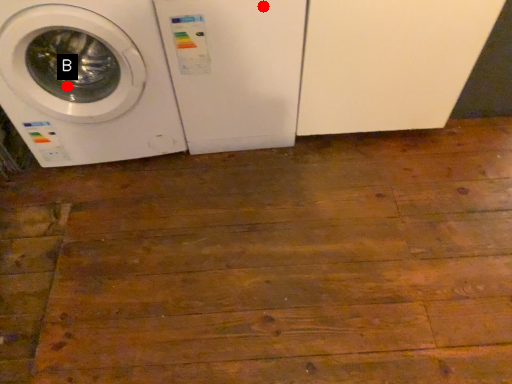
Question: Two points are circled on the image, labeled by A and B beside each circle. Which point appears farthest from the camera in this image?

Choices:
 (A) A is further
 (B) B is further

Answer: (B)